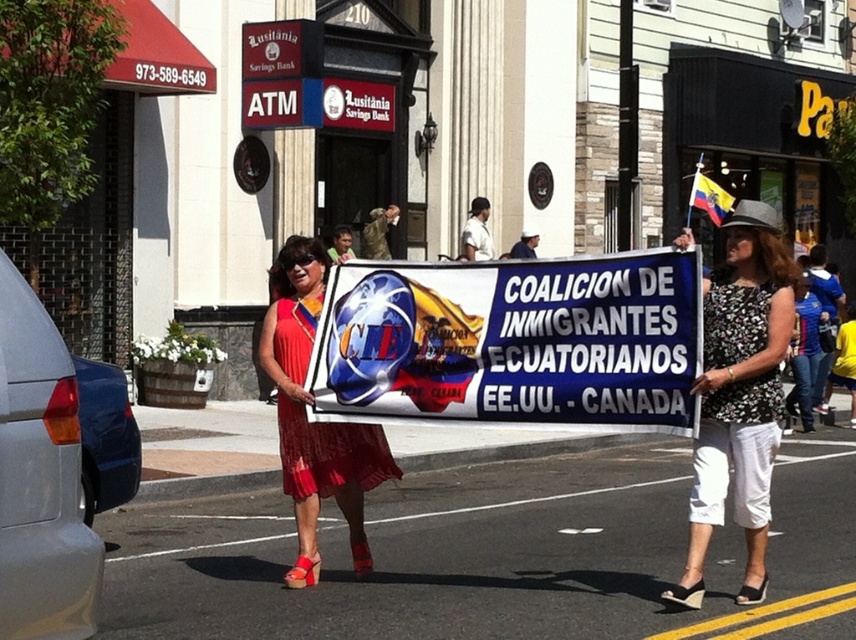
Which is below, white fabric banner at center or white uniform at center?

white fabric banner at center is below.

Which is in front, point (476, 406) or point (526, 241)?

Point (476, 406) is in front.

Find the location of a particular element. Image resolution: width=856 pixels, height=640 pixels. white fabric banner at center is located at coordinates (512, 342).

Is point (307, 470) behind point (697, 196)?

No, it is in front of (697, 196).

Who is positioned more to the left, red chiffon dress at center or yellow and blue fabric flag at upper right?

red chiffon dress at center is more to the left.

Which is behind, point (294, 268) or point (706, 192)?

Point (706, 192)

The height and width of the screenshot is (640, 856). I want to click on red chiffon dress at center, so click(x=314, y=422).

Is white cotton shirt at upper center above white uniform at center?

Yes.

Between white cotton shirt at upper center and white uniform at center, which one is positioned lower?

white uniform at center is lower down.

Between point (477, 243) and point (533, 253), which one is positioned in front?

Point (477, 243) is more forward.

Find the location of a particular element. The image size is (856, 640). white cotton shirt at upper center is located at coordinates (476, 230).